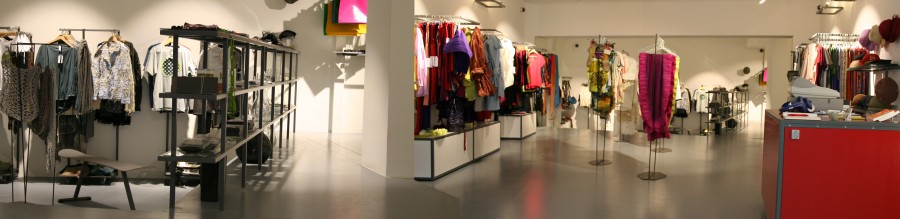
Identify the location of items on shelves. (216, 77), (253, 115), (258, 144), (202, 141).